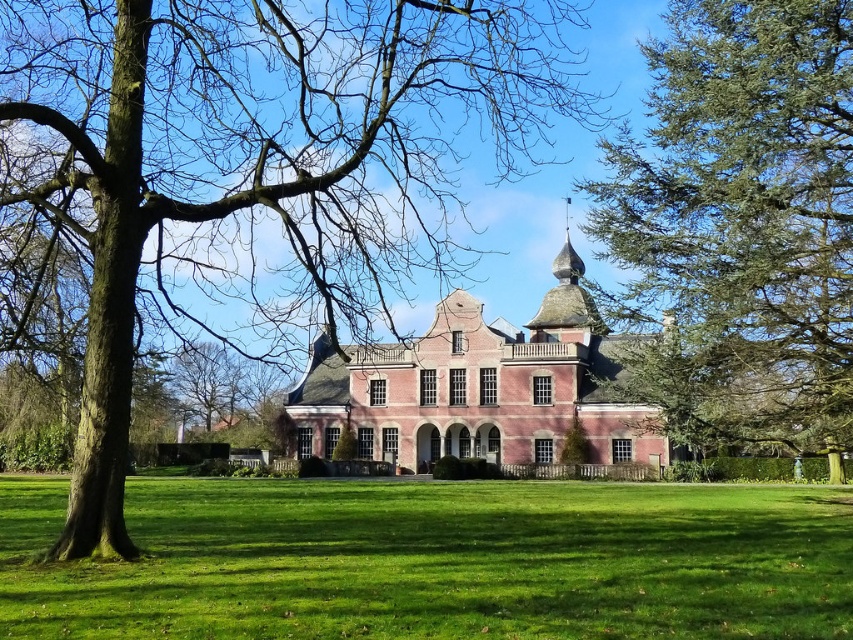
You are standing at the entrance of the historic building and want to take a photo of the brown bark tree at center. Which direction should you face to capture it in your view?

You should face towards the center of the lawn since the brown bark tree at center is located at point coordinates of [250,166], which is centrally positioned in the image.

You are a landscape architect designing a walking path between the brown bark tree at center and the brick mansion at center. If the path must be exactly 25 meters long, will it reach the mansion from the tree?

The distance between the brown bark tree at center and the brick mansion at center is 27.39 meters. Since the path is only 25 meters long, it will not reach the mansion from the tree.

You are planning to host a garden party and need to know the available space. Based on the image, which object occupies more area in the scene between the green grass at center and the brick mansion at center?

The brick mansion at center occupies more area than the green grass at center in the scene.